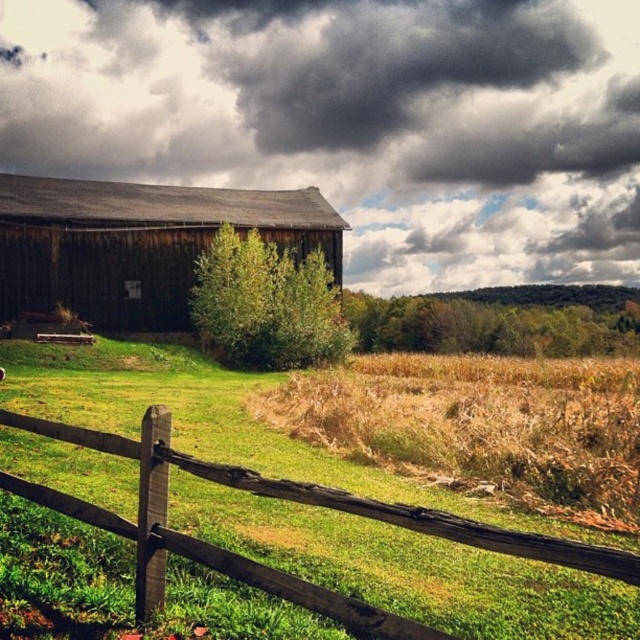
Question: Which of the following is the farthest from the observer?

Choices:
 (A) brown wooden fence at lower left
 (B) dark brown wooden barn at center
 (C) weathered wood barn at left

Answer: (C)

Question: Does dark brown wooden barn at center have a smaller size compared to brown wooden fence at lower left?

Choices:
 (A) yes
 (B) no

Answer: (B)

Question: Estimate the real-world distances between objects in this image. Which object is farther from the weathered wood barn at left?

Choices:
 (A) brown wooden fence at lower left
 (B) dark brown wooden barn at center

Answer: (A)

Question: Which object is closer to the camera taking this photo?

Choices:
 (A) dark brown wooden barn at center
 (B) weathered wood barn at left

Answer: (A)

Question: Is dark brown wooden barn at center smaller than brown wooden fence at lower left?

Choices:
 (A) no
 (B) yes

Answer: (A)

Question: Is weathered wood barn at left to the right of brown wooden fence at lower left from the viewer's perspective?

Choices:
 (A) no
 (B) yes

Answer: (A)